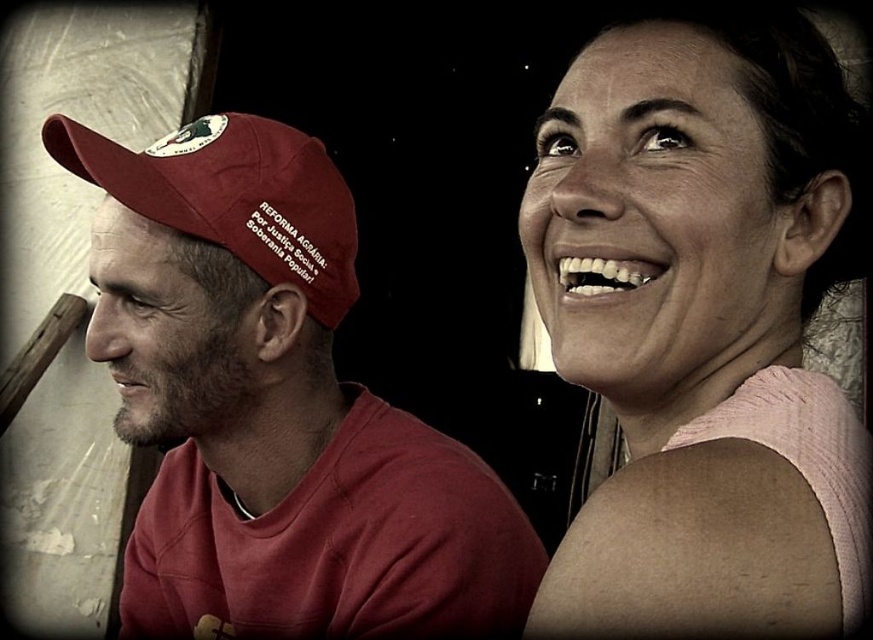
Question: Is pink fabric at upper right positioned behind matte red cap at left?

Choices:
 (A) no
 (B) yes

Answer: (A)

Question: Which point appears closest to the camera in this image?

Choices:
 (A) (332, 218)
 (B) (734, 164)

Answer: (B)

Question: Is matte red cap at left positioned in front of maroon fabric cap at left?

Choices:
 (A) no
 (B) yes

Answer: (B)

Question: Based on their relative distances, which object is farther from the maroon fabric cap at left?

Choices:
 (A) pink fabric at upper right
 (B) matte red cap at left

Answer: (A)

Question: Which object appears farthest from the camera in this image?

Choices:
 (A) maroon fabric cap at left
 (B) pink fabric at upper right
 (C) matte red cap at left

Answer: (A)

Question: Considering the relative positions of pink fabric at upper right and matte red cap at left in the image provided, where is pink fabric at upper right located with respect to matte red cap at left?

Choices:
 (A) above
 (B) below

Answer: (A)